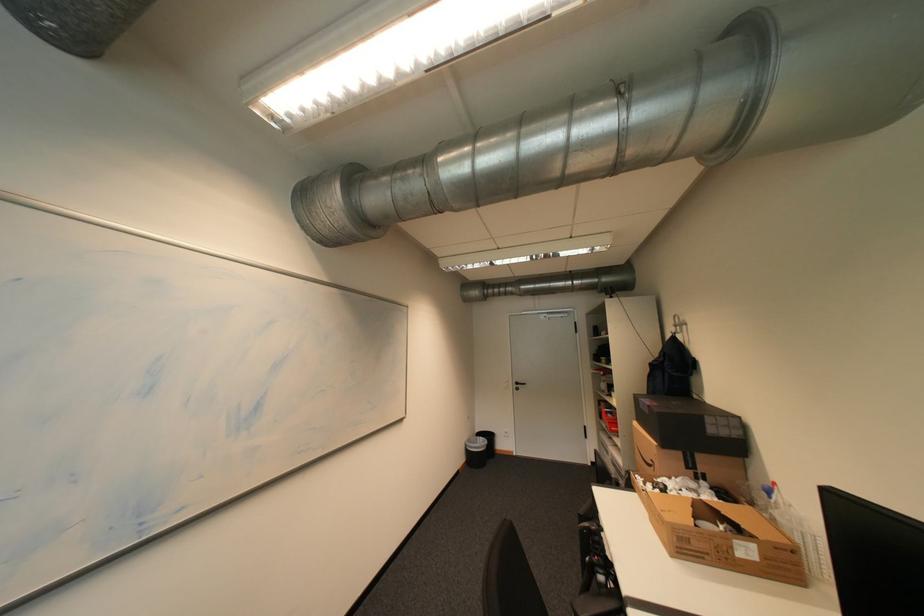
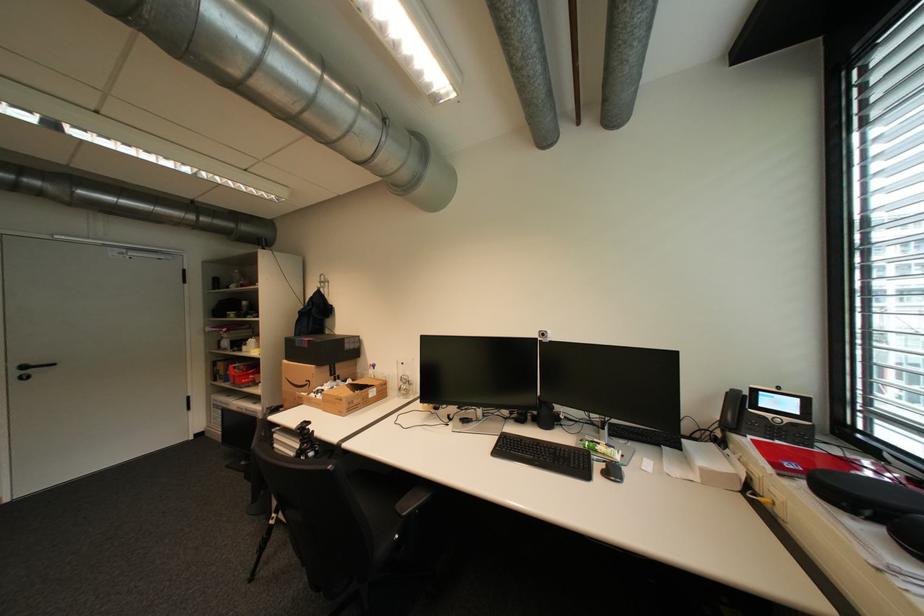
The point at (662, 464) is marked in the first image. Where is the corresponding point in the second image?

(317, 383)